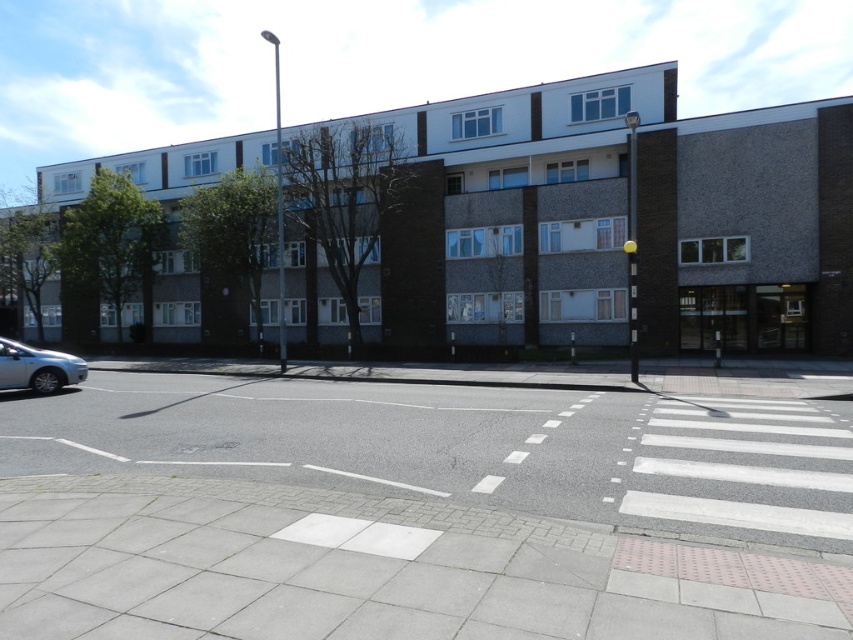
You are a delivery robot positioned at the origin point of the coordinate system. You need to navigate to the white asphalt at center. What are the coordinates you should move towards?

The coordinates to move towards are 0.700 in the x direction and 0.547 in the y direction.

You are a pedestrian standing on the sidewalk near the crosswalk. You see the white asphalt at center and the silver metallic car at lower left. Which object is closer to the lamppost?

The silver metallic car at lower left is closer to the lamppost because the white asphalt at center is to the right of it, meaning the car is positioned between the lamppost and the asphalt.